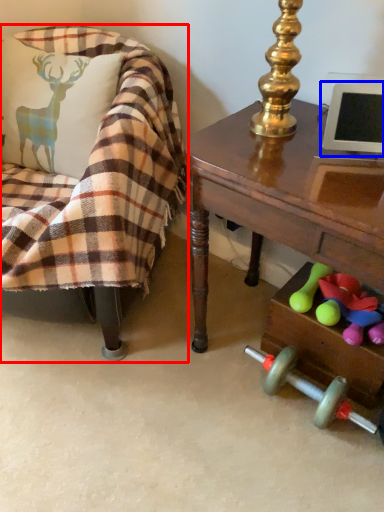
Question: Which point is further to the camera, chair (highlighted by a red box) or computer monitor (highlighted by a blue box)?

Choices:
 (A) chair
 (B) computer monitor

Answer: (B)